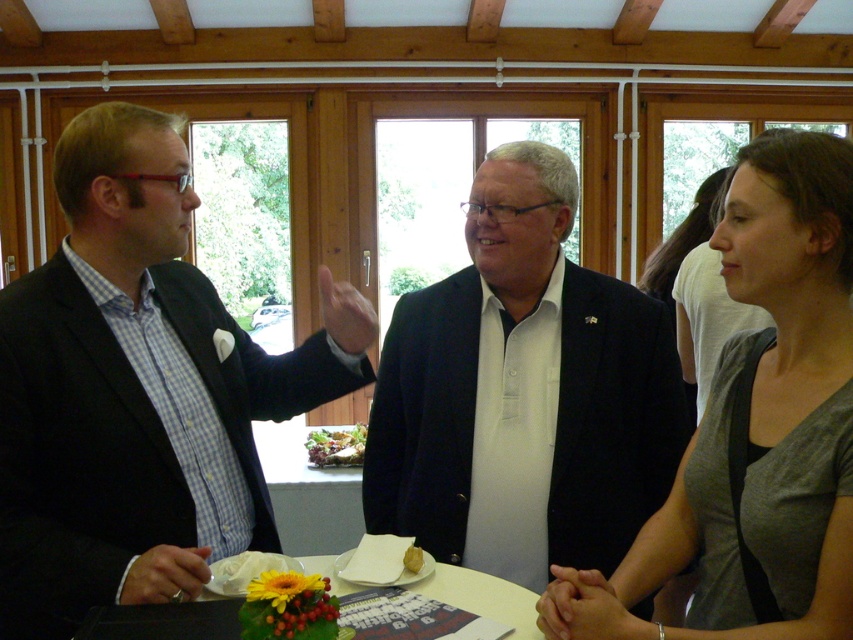
You are organizing a photo shoot and need to ensure that the dark blue suit at center and the yellow matte bread at center are both visible in the frame. Given their sizes, which object might require more space in the composition?

The dark blue suit at center requires more space in the composition because its width is larger than the yellow matte bread at center.

Where is the matte black suit at left located in the image?

The matte black suit at left is located at point (138, 388).

You are standing in the room and want to hand the yellow matte bread at center to the person wearing the dark blue suit at center. Which object should you move closer to first?

You should move closer to the dark blue suit at center first because it is closer to you than the yellow matte bread at center, which is further away.